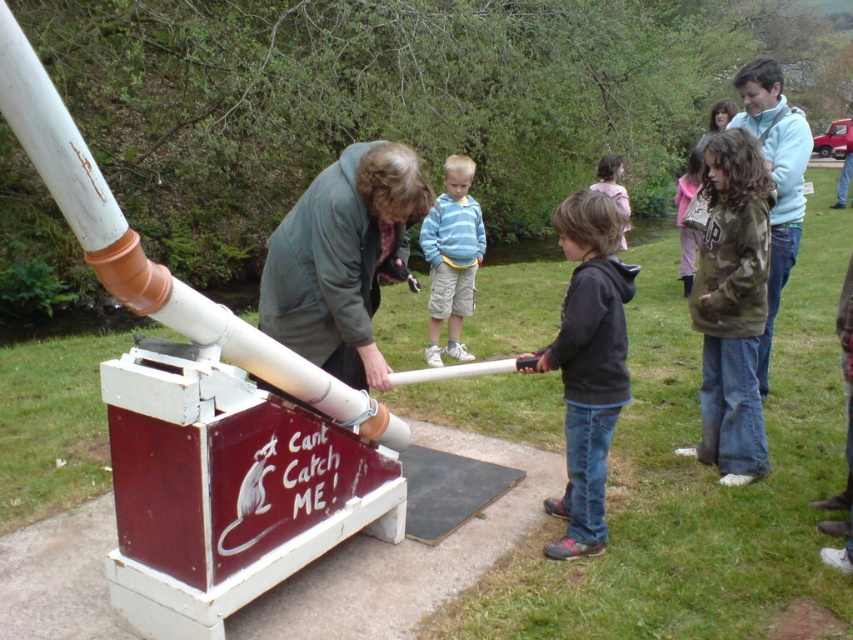
Does blue striped shirt at center have a larger size compared to light brown hair at center?

Actually, blue striped shirt at center might be smaller than light brown hair at center.

Can you confirm if blue striped shirt at center is shorter than light brown hair at center?

Yes, blue striped shirt at center is shorter than light brown hair at center.

Describe the element at coordinates (451, 257) in the screenshot. I see `blue striped shirt at center` at that location.

At what (x,y) coordinates should I click in order to perform the action: click on blue striped shirt at center. Please return your answer as a coordinate pair (x, y). The width and height of the screenshot is (853, 640). Looking at the image, I should click on (451, 257).

Which is behind, point (743, 182) or point (460, 288)?

Point (460, 288)

This screenshot has height=640, width=853. Describe the element at coordinates (732, 307) in the screenshot. I see `camo fabric hoodie at lower right` at that location.

Find the location of a particular element. camo fabric hoodie at lower right is located at coordinates (732, 307).

Between white matte pipe at center and light blue sweater at upper right, which one is positioned lower?

white matte pipe at center is lower down.

In the scene shown: Does white matte pipe at center have a larger size compared to light blue sweater at upper right?

Correct, white matte pipe at center is larger in size than light blue sweater at upper right.

Who is more distant from viewer, (142, 301) or (804, 172)?

Positioned behind is point (804, 172).

Locate an element on the screen. white matte pipe at center is located at coordinates (149, 259).